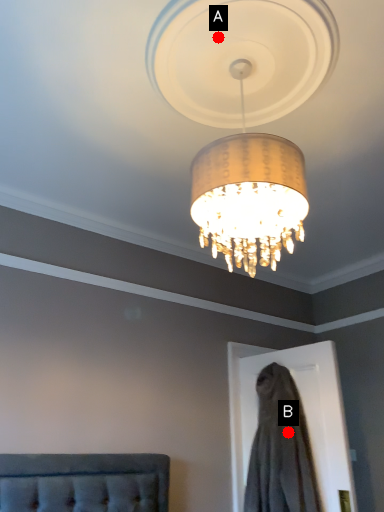
Question: Two points are circled on the image, labeled by A and B beside each circle. Which point is closer to the camera?

Choices:
 (A) A is closer
 (B) B is closer

Answer: (A)